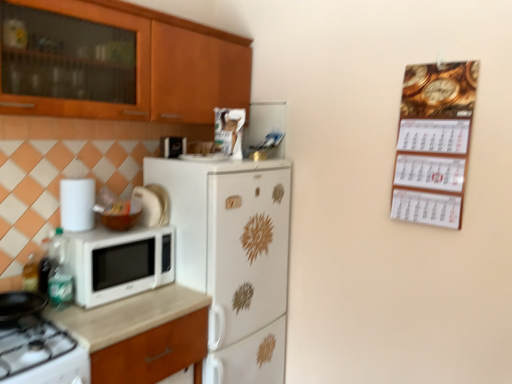
The image size is (512, 384). What do you see at coordinates (157, 66) in the screenshot? I see `wooden cabinet at upper left` at bounding box center [157, 66].

Locate an element on the screen. Image resolution: width=512 pixels, height=384 pixels. white glossy microwave at left, the 3th appliance from the top is located at coordinates (148, 206).

From the image's perspective, who appears lower, wooden cabinet at upper left or white glossy gas stove at lower left?

white glossy gas stove at lower left is shown below in the image.

Is wooden cabinet at upper left wider or thinner than white glossy gas stove at lower left?

In the image, wooden cabinet at upper left appears to be more narrow than white glossy gas stove at lower left.

From a real-world perspective, is wooden cabinet at upper left positioned above or below white glossy gas stove at lower left?

wooden cabinet at upper left is above white glossy gas stove at lower left.

From the picture: Considering the relative sizes of beige laminate countertop at lower left and metallic silver microwave at upper center, placed as the 3th appliance when sorted from left to right, in the image provided, is beige laminate countertop at lower left smaller than metallic silver microwave at upper center, placed as the 3th appliance when sorted from left to right,?

Incorrect, beige laminate countertop at lower left is not smaller in size than metallic silver microwave at upper center, placed as the 3th appliance when sorted from left to right.

Who is more distant, beige laminate countertop at lower left or metallic silver microwave at upper center, placed as the 3th appliance when sorted from left to right?

metallic silver microwave at upper center, placed as the 3th appliance when sorted from left to right, is further from the camera.

From a real-world perspective, which object stands above the other?

metallic silver microwave at upper center, the third appliance when ordered from bottom to top.

Is white glossy microwave at left, which is counted as the second appliance, starting from the front, placed right next to metallic silver microwave at upper center, the third appliance when ordered from bottom to top?

No.

What's the angular difference between white glossy microwave at left, the second appliance from the back, and metallic silver microwave at upper center, the 1th appliance when ordered from back to front,'s facing directions?

88.8 degrees separate the facing orientations of white glossy microwave at left, the second appliance from the back, and metallic silver microwave at upper center, the 1th appliance when ordered from back to front.

You are a GUI agent. You are given a task and a screenshot of the screen. Output one action in this format:
    pyautogui.click(x=<x>, y=<y>)
    Task: Click on the 2nd appliance positioned below the metallic silver microwave at upper center, placed as the 3th appliance when sorted from left to right (from a real-world perspective)
    
    Given the screenshot: What is the action you would take?
    pyautogui.click(x=148, y=206)

Does wooden cabinet at upper left have a larger size compared to white matte microwave at left?

Correct, wooden cabinet at upper left is larger in size than white matte microwave at left.

Which object is more forward, wooden cabinet at upper left or white matte microwave at left?

Positioned in front is wooden cabinet at upper left.

From the image's perspective, which object appears higher, wooden cabinet at upper left or white matte microwave at left?

From the image's view, wooden cabinet at upper left is above.

Is wooden cabinet at upper left positioned with its back to white matte microwave at left?

No, wooden cabinet at upper left is not facing the opposite direction of white matte microwave at left.

From the image's perspective, is metallic silver microwave at upper center, the 1th appliance when ordered from back to front, beneath gold metallic calendar at upper right?

Actually, metallic silver microwave at upper center, the 1th appliance when ordered from back to front, appears above gold metallic calendar at upper right in the image.

Looking at the image, does metallic silver microwave at upper center, which appears as the 3th appliance when viewed from the front, seem bigger or smaller compared to gold metallic calendar at upper right?

Considering their sizes, metallic silver microwave at upper center, which appears as the 3th appliance when viewed from the front, takes up less space than gold metallic calendar at upper right.

Is metallic silver microwave at upper center, the third appliance when ordered from bottom to top, facing towards gold metallic calendar at upper right?

No.

Visually, is gold metallic calendar at upper right positioned to the left or to the right of white glossy gas stove at lower left?

gold metallic calendar at upper right is to the right of white glossy gas stove at lower left.

How different are the orientations of gold metallic calendar at upper right and white glossy gas stove at lower left in degrees?

They differ by 90 degrees in their facing directions.

Is point (448, 138) more distant than point (39, 348)?

Yes, point (448, 138) is behind point (39, 348).

Is gold metallic calendar at upper right facing towards white glossy gas stove at lower left?

No, gold metallic calendar at upper right is not aimed at white glossy gas stove at lower left.

From the image's perspective, which one is positioned lower, white glossy gas stove at lower left or metallic silver microwave at upper center, placed as the 3th appliance when sorted from left to right?

white glossy gas stove at lower left.

Based on the photo, could you tell me if white glossy gas stove at lower left is turned towards metallic silver microwave at upper center, the 1th appliance when ordered from back to front?

No, white glossy gas stove at lower left is not aimed at metallic silver microwave at upper center, the 1th appliance when ordered from back to front.

Between white glossy gas stove at lower left and metallic silver microwave at upper center, which appears as the 3th appliance when viewed from the front, which one is positioned in front?

white glossy gas stove at lower left is closer to the camera.

Based on the photo, which is correct: white glossy gas stove at lower left is inside metallic silver microwave at upper center, the 1th appliance when ordered from back to front, or outside of it?

white glossy gas stove at lower left exists outside the volume of metallic silver microwave at upper center, the 1th appliance when ordered from back to front.

Where is `gas stove that is under the wooden cabinet at upper left (from a real-world perspective)`? gas stove that is under the wooden cabinet at upper left (from a real-world perspective) is located at coordinates (41, 355).

From a real-world perspective, which appliance is the 3rd one above the beige laminate countertop at lower left? Please provide its 2D coordinates.

[(264, 121)]

Which object lies further to the anchor point beige laminate countertop at lower left, gold metallic calendar at upper right or white matte microwave at left?

gold metallic calendar at upper right lies further to beige laminate countertop at lower left than the other object.

Estimate the real-world distances between objects in this image. Which object is closer to gold metallic calendar at upper right, white glossy gas stove at lower left or wooden cabinet at upper left?

→ wooden cabinet at upper left.

Looking at the image, which one is located closer to white matte microwave at left, metallic silver microwave at upper center, placed as the 3th appliance when sorted from left to right, or wooden cabinet at upper left?

wooden cabinet at upper left is closer to white matte microwave at left.

Considering their positions, is gold metallic calendar at upper right positioned further to white glossy gas stove at lower left than metallic silver microwave at upper center, which appears as the 3th appliance when viewed from the front?

gold metallic calendar at upper right is further to white glossy gas stove at lower left.

Which object lies nearer to the anchor point white glossy gas stove at lower left, metallic silver microwave at upper center, the third appliance when ordered from bottom to top, or white glossy refrigerator at center?

white glossy refrigerator at center.

When comparing their distances from white glossy gas stove at lower left, does white matte paper towel holder at left, which is the 1th appliance in front-to-back order, or gold metallic calendar at upper right seem further?

Based on the image, gold metallic calendar at upper right appears to be further to white glossy gas stove at lower left.

When comparing their distances from white glossy refrigerator at center, does white matte microwave at left or metallic silver microwave at upper center, which appears as the 3th appliance when viewed from the front, seem further?

Among the two, metallic silver microwave at upper center, which appears as the 3th appliance when viewed from the front, is located further to white glossy refrigerator at center.

Estimate the real-world distances between objects in this image. Which object is closer to beige laminate countertop at lower left, metallic silver microwave at upper center, arranged as the 1th appliance when viewed from the top, or gold metallic calendar at upper right?

metallic silver microwave at upper center, arranged as the 1th appliance when viewed from the top, is closer to beige laminate countertop at lower left.

Where is `countertop located between white matte microwave at left and white glossy refrigerator at center in the left-right direction`? The height and width of the screenshot is (384, 512). countertop located between white matte microwave at left and white glossy refrigerator at center in the left-right direction is located at coordinates (141, 334).

At what (x,y) coordinates should I click in order to perform the action: click on microwave oven between white glossy microwave at left, positioned as the 2th appliance in left-to-right order, and white glossy refrigerator at center, in the vertical direction. Please return your answer as a coordinate pair (x, y). Looking at the image, I should click on (119, 262).

Find the location of a particular element. This screenshot has width=512, height=384. microwave oven between white glossy gas stove at lower left and white glossy microwave at left, the second appliance from the back, in the front-back direction is located at coordinates (119, 262).

Find the location of a particular element. The height and width of the screenshot is (384, 512). appliance situated between white matte paper towel holder at left, the first appliance in the left-to-right sequence, and white glossy refrigerator at center from left to right is located at coordinates (148, 206).